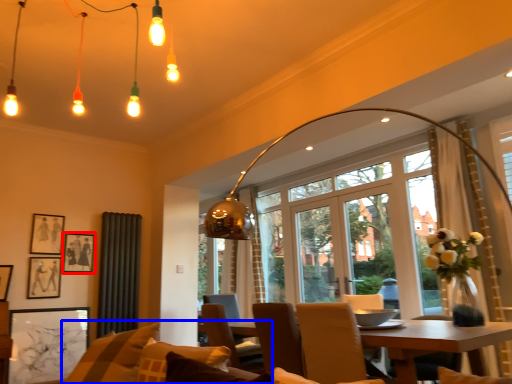
Question: Among these objects, which one is farthest to the camera, picture frame (highlighted by a red box) or couch (highlighted by a blue box)?

Choices:
 (A) picture frame
 (B) couch

Answer: (A)